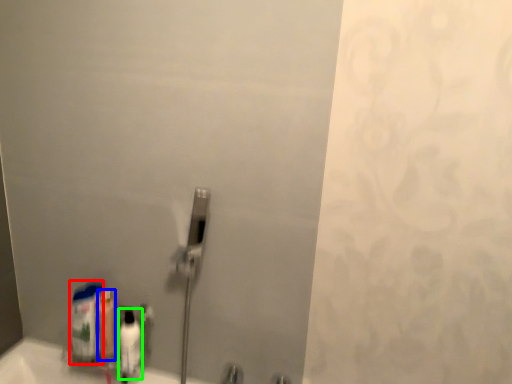
Question: Which is nearer to the cleaning product (highlighted by a red box)? mouthwash (highlighted by a blue box) or mouthwash (highlighted by a green box).

Choices:
 (A) mouthwash
 (B) mouthwash

Answer: (A)